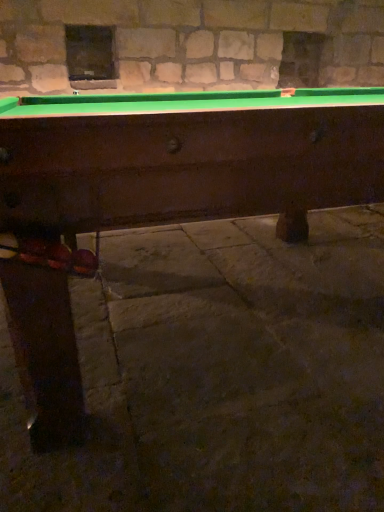
This screenshot has height=512, width=384. What do you see at coordinates (187, 159) in the screenshot? I see `green felt pool table at center` at bounding box center [187, 159].

Where is `green felt pool table at center`? green felt pool table at center is located at coordinates (187, 159).

Measure the distance between green felt pool table at center and camera.

green felt pool table at center and camera are 29.09 inches apart.

I want to click on green felt pool table at center, so click(x=187, y=159).